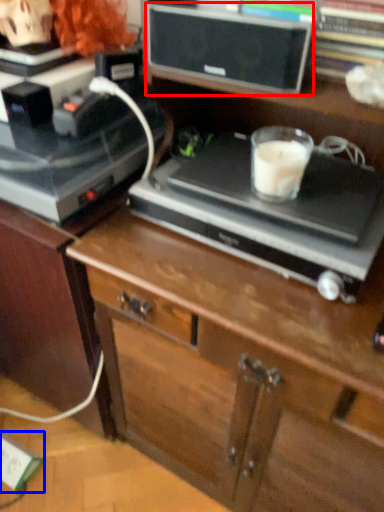
Question: Which object is further to the camera taking this photo, speaker (highlighted by a red box) or electric outlet (highlighted by a blue box)?

Choices:
 (A) speaker
 (B) electric outlet

Answer: (B)